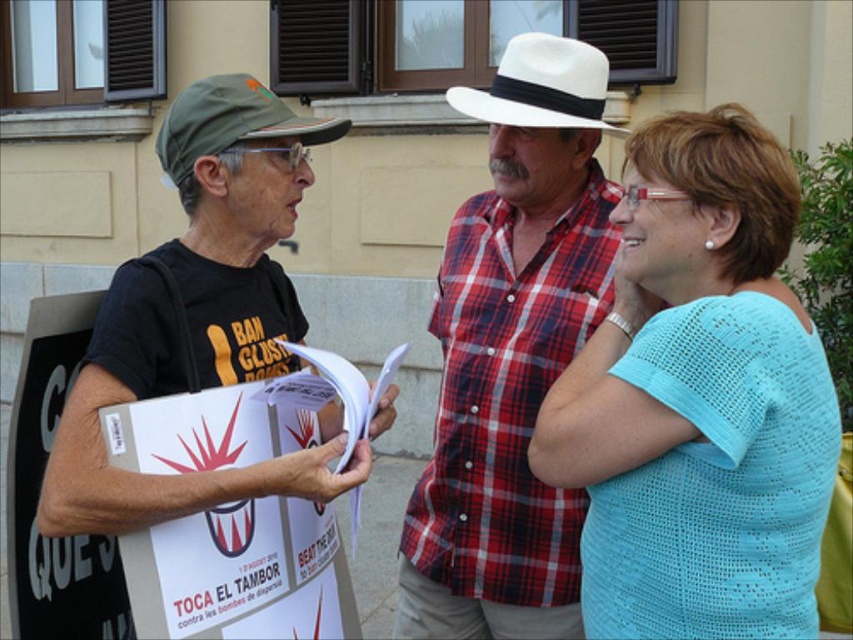
You are standing at point A located at coordinates point (561, 115) and want to walk to point B located at coordinates point (561, 292). However, there is an obstacle blocking your path. Which direction should you move to go around the obstacle and reach point B?

Since point (561, 292) is behind point (561, 115), you should move either to the left or right to go around the obstacle and reach point B.

You are a photographer standing at the back of the scene. You want to take a photo that includes both the white plaid shirt at center and the white felt cowboy hat at upper center. Given that your camera has a maximum focus range of 15 inches, will you be able to capture both subjects clearly in the same frame?

The distance between the white plaid shirt at center and the white felt cowboy hat at upper center is 15.67 inches, which exceeds the camera maximum focus range of 15 inches. Therefore, you cannot capture both subjects clearly in the same frame.